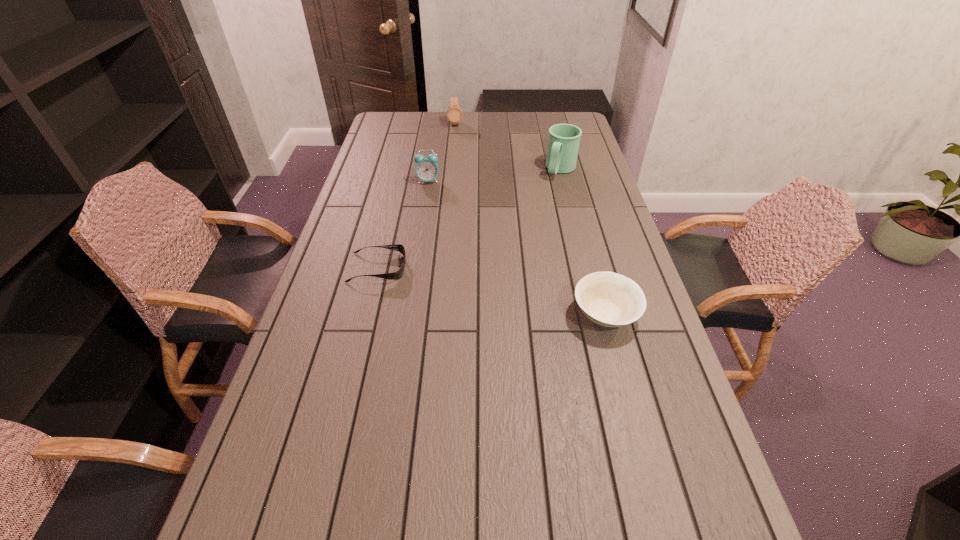
Image resolution: width=960 pixels, height=540 pixels. I want to click on empty space between the third object from right to left and the sunglasses, so click(417, 196).

Image resolution: width=960 pixels, height=540 pixels. Find the location of `vacant space that's between the third object from right to left and the shortest object`. vacant space that's between the third object from right to left and the shortest object is located at coordinates (417, 196).

Where is `vacant area between the mug and the alarm clock`? The height and width of the screenshot is (540, 960). vacant area between the mug and the alarm clock is located at coordinates (494, 176).

Identify the location of free space between the shortest object and the farthest object. The image size is (960, 540). (417, 196).

Find the location of a particular element. vacant space that is in between the nearest object and the alarm clock is located at coordinates pyautogui.click(x=516, y=248).

Where is `free spot between the alarm clock and the mug`? free spot between the alarm clock and the mug is located at coordinates (494, 176).

Find the location of a particular element. This screenshot has height=540, width=960. blank region between the bowl and the shortest object is located at coordinates (492, 291).

I want to click on vacant area between the alarm clock and the third object from left to right, so click(x=442, y=152).

Identify the location of the third closest object relative to the second shortest object. This screenshot has width=960, height=540. (426, 169).

Locate an element on the screen. The image size is (960, 540). the fourth closest object to the fourth farthest object is located at coordinates 454,113.